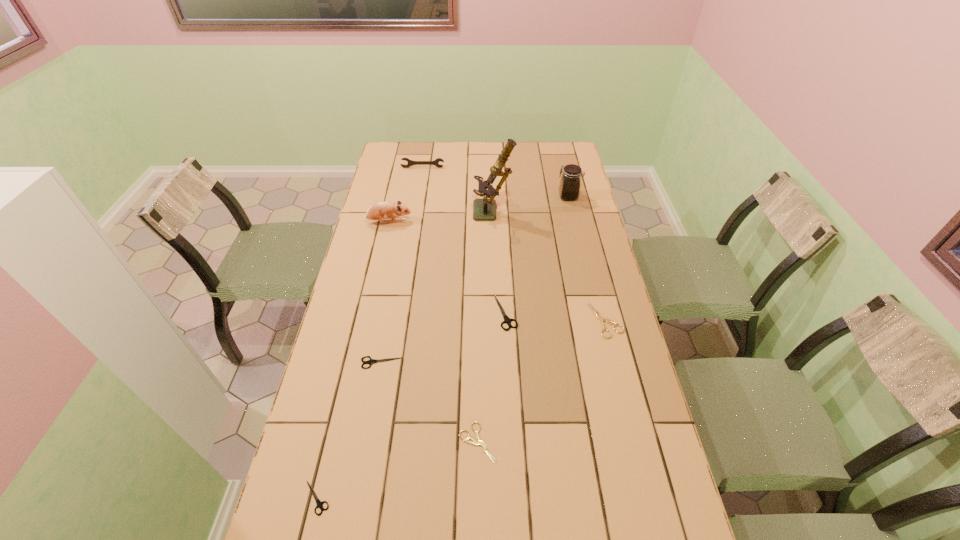
Locate an element on the screen. This screenshot has height=540, width=960. the second farthest black shears is located at coordinates (371, 361).

Find the location of a particular element. the bigger beige shears is located at coordinates [601, 319].

Locate an element on the screen. The image size is (960, 540). the rightmost shears is located at coordinates (601, 319).

Find the location of `the nearer beige shears`. the nearer beige shears is located at coordinates (474, 442).

Where is `the second nearest object`? The height and width of the screenshot is (540, 960). the second nearest object is located at coordinates (474, 442).

Where is `the smallest black shears`? the smallest black shears is located at coordinates (319, 503).

At what (x,y) coordinates should I click in order to perform the action: click on the nearest object. Please return your answer as a coordinate pair (x, y). This screenshot has width=960, height=540. Looking at the image, I should click on (319, 503).

Where is `vacant region located 0.290m at the eyepiece of the brown microscope`? Image resolution: width=960 pixels, height=540 pixels. vacant region located 0.290m at the eyepiece of the brown microscope is located at coordinates (402, 213).

Where is `vacant space located at the eyepiece of the brown microscope`? The width and height of the screenshot is (960, 540). vacant space located at the eyepiece of the brown microscope is located at coordinates (424, 213).

Identify the location of free space located at the eyepiece of the brown microscope. This screenshot has width=960, height=540. 442,213.